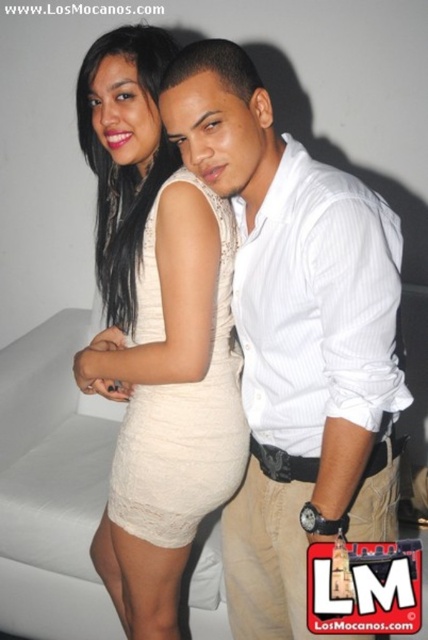
Which is below, white striped shirt at center or white fabric couch at lower left?

white fabric couch at lower left

How distant is white striped shirt at center from white fabric couch at lower left?

white striped shirt at center is 76.36 centimeters from white fabric couch at lower left.

The width and height of the screenshot is (428, 640). In order to click on white striped shirt at center in this screenshot , I will do `click(296, 339)`.

Can you confirm if white fabric couch at lower left is smaller than lace beige dress at center?

Actually, white fabric couch at lower left might be larger than lace beige dress at center.

At what (x,y) coordinates should I click in order to perform the action: click on white fabric couch at lower left. Please return your answer as a coordinate pair (x, y). Looking at the image, I should click on (50, 488).

Describe the element at coordinates (50, 488) in the screenshot. I see `white fabric couch at lower left` at that location.

The width and height of the screenshot is (428, 640). I want to click on white fabric couch at lower left, so click(x=50, y=488).

Which is below, white striped shirt at center or lace beige dress at center?

white striped shirt at center is lower down.

What do you see at coordinates (296, 339) in the screenshot? Image resolution: width=428 pixels, height=640 pixels. I see `white striped shirt at center` at bounding box center [296, 339].

At what (x,y) coordinates should I click in order to perform the action: click on white striped shirt at center. Please return your answer as a coordinate pair (x, y). Looking at the image, I should click on (296, 339).